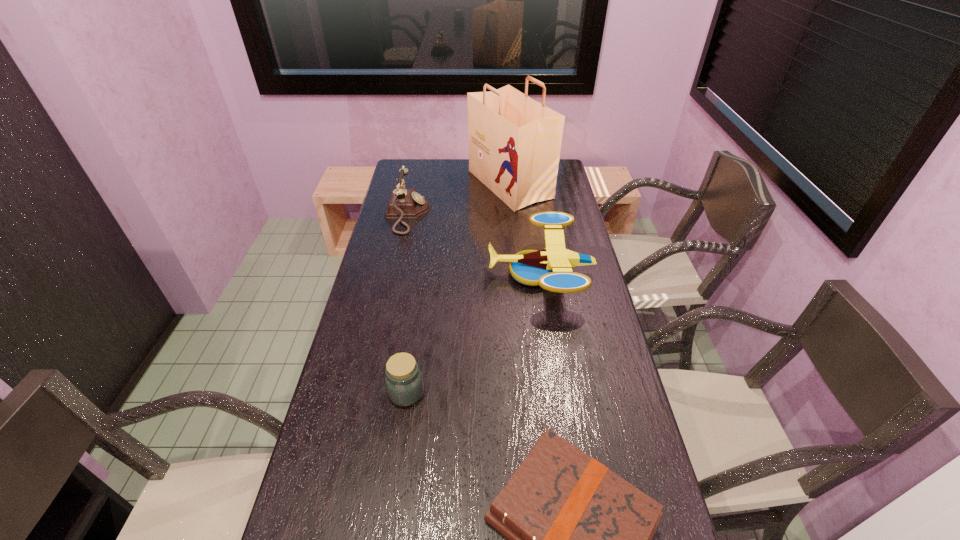
Locate an element on the screen. vacant space that satisfies the following two spatial constraints: 1. on the dial of the fourth shortest object; 2. on the left side of the jar is located at coordinates (370, 393).